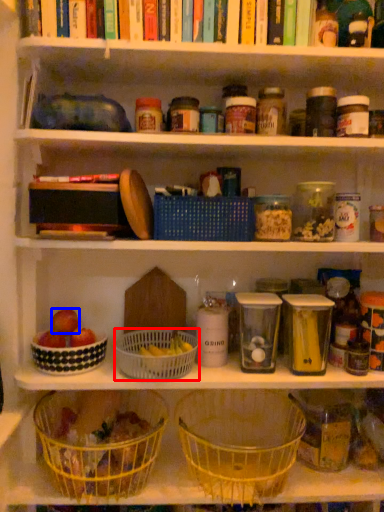
Question: Which of the following is the farthest to the observer, basket (highlighted by a red box) or apple (highlighted by a blue box)?

Choices:
 (A) basket
 (B) apple

Answer: (B)